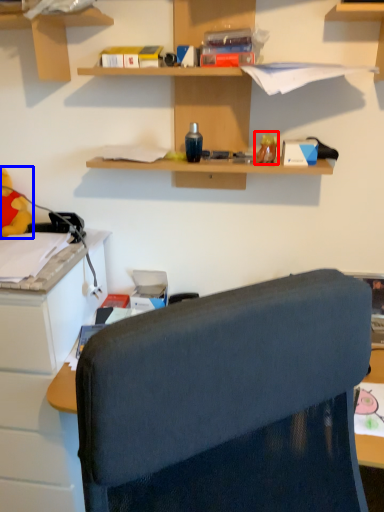
Question: Which object is further to the camera taking this photo, toy (highlighted by a red box) or toy (highlighted by a blue box)?

Choices:
 (A) toy
 (B) toy

Answer: (B)